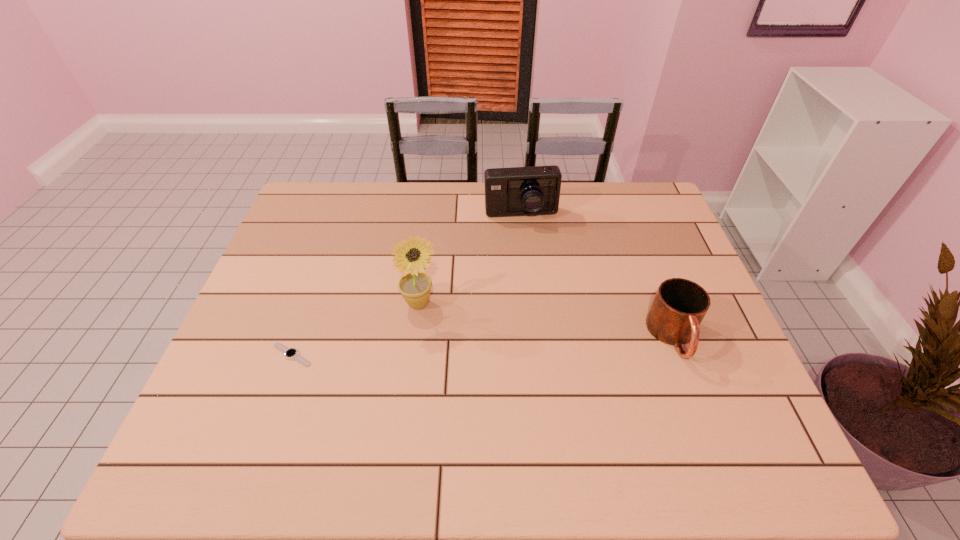
Find the location of a particular element. The image size is (960, 540). watch is located at coordinates (290, 353).

Identify the location of the shortest object. The image size is (960, 540). (290, 353).

This screenshot has width=960, height=540. I want to click on the second shortest object, so click(x=679, y=306).

This screenshot has width=960, height=540. In order to click on mug in this screenshot , I will do `click(679, 306)`.

Identify the location of the second tallest object. pyautogui.click(x=517, y=191).

Identify the location of camera. (517, 191).

This screenshot has height=540, width=960. What are the coordinates of `sunflower` in the screenshot? It's located at (415, 286).

Identify the location of the tallest object. This screenshot has height=540, width=960. (415, 286).

You are a GUI agent. You are given a task and a screenshot of the screen. Output one action in this format:
    pyautogui.click(x=<x>, y=<y>)
    Task: Click on the free region located on the right of the leftmost object
    The image size is (960, 540).
    Given the screenshot: What is the action you would take?
    pyautogui.click(x=424, y=354)

The height and width of the screenshot is (540, 960). I want to click on free space located on the side of the rightmost object with the handle, so click(x=698, y=402).